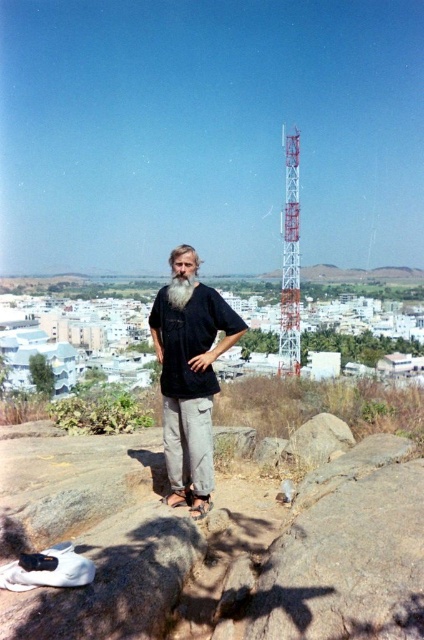
You are a photographer trying to capture the man in the scene. You notice the black matte shirt at center and the white soft beard at center. Which object should you focus on first to ensure the subject is sharp in the photo?

The black matte shirt at center is in front of the white soft beard at center, so you should focus on the black matte shirt at center first to ensure the subject is sharp.